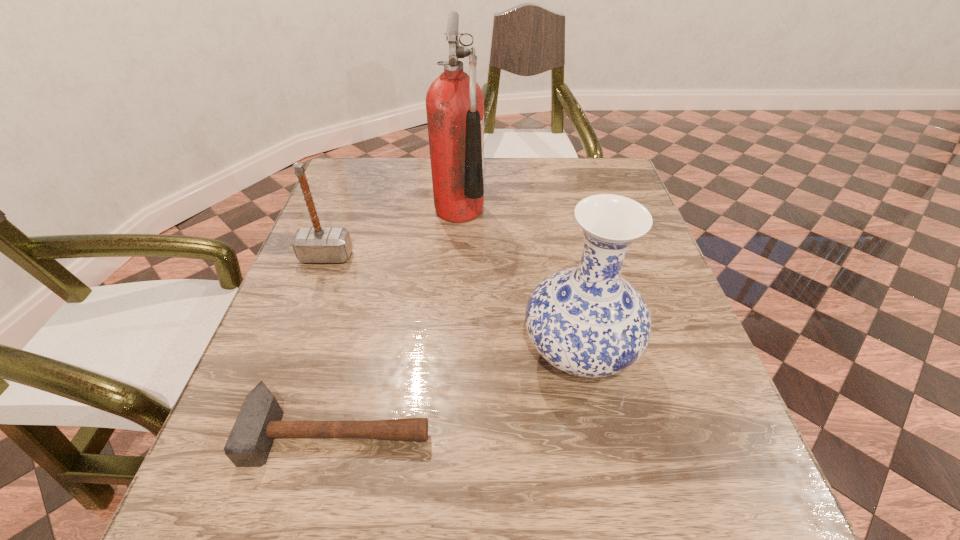
The image size is (960, 540). In order to click on vacant area situated 0.050m on the striking surface of the second farthest object in this screenshot , I will do `click(317, 281)`.

Where is `vacant space situated on the striking surface of the shortest object`? The width and height of the screenshot is (960, 540). vacant space situated on the striking surface of the shortest object is located at coordinates pyautogui.click(x=319, y=511).

At what (x,y) coordinates should I click in order to perform the action: click on object located at the far edge. Please return your answer as a coordinate pair (x, y). Looking at the image, I should click on (454, 102).

Where is `object positioned at the right edge`? object positioned at the right edge is located at coordinates (587, 321).

Where is `vacant region at the far edge of the desktop`? This screenshot has height=540, width=960. vacant region at the far edge of the desktop is located at coordinates (501, 166).

Locate an element on the screen. This screenshot has width=960, height=540. vacant area at the near edge is located at coordinates (390, 530).

The image size is (960, 540). What are the coordinates of `free space at the left edge of the desktop` in the screenshot? It's located at (293, 346).

I want to click on free space at the right edge of the desktop, so click(x=650, y=282).

Identify the location of empty space that is in between the second farthest object and the rightmost object. (452, 305).

Where is `free space between the third tallest object and the shortest object`? The image size is (960, 540). free space between the third tallest object and the shortest object is located at coordinates (332, 343).